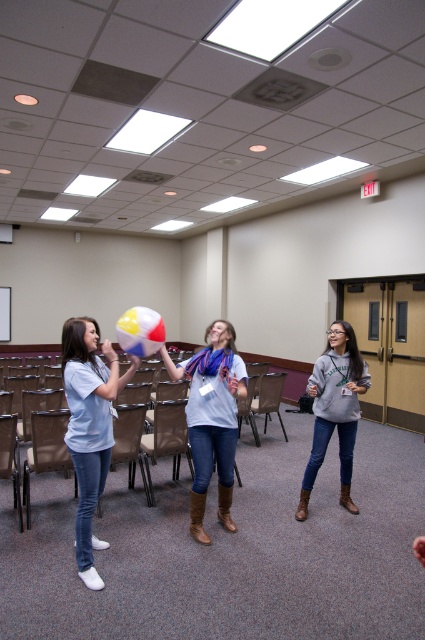
You are standing in the conference room and want to find the matte blue shirt at left. According to the coordinates provided, where should you look?

The matte blue shirt at left is located at the 2D coordinates point (90, 426).